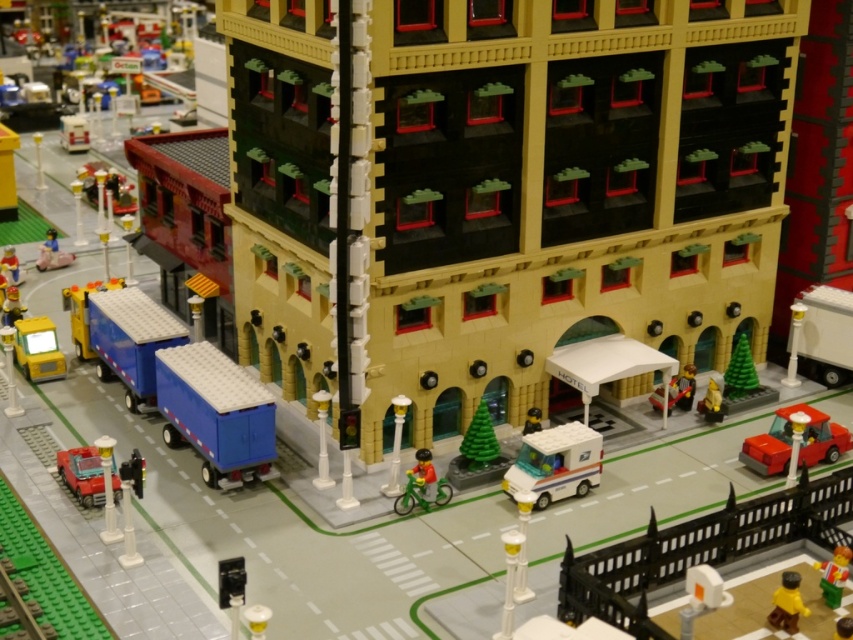
Is yellow matte figure at lower right taller than green plastic figure at lower right?

Yes, yellow matte figure at lower right is taller than green plastic figure at lower right.

Does yellow matte figure at lower right come behind green plastic figure at lower right?

No, it is in front of green plastic figure at lower right.

This screenshot has height=640, width=853. Describe the element at coordinates (787, 604) in the screenshot. I see `yellow matte figure at lower right` at that location.

Locate an element on the screen. This screenshot has width=853, height=640. yellow matte figure at lower right is located at coordinates pos(787,604).

In the scene shown: Is matte yellow truck at left taller than matte black mailbox at center?

Yes, matte yellow truck at left is taller than matte black mailbox at center.

Is matte yellow truck at left thinner than matte black mailbox at center?

No, matte yellow truck at left is not thinner than matte black mailbox at center.

Locate an element on the screen. matte yellow truck at left is located at coordinates (38, 348).

Identify the location of matte yellow truck at left. (38, 348).

Consider the image. Is matte yellow truck at left smaller than green matte christmas tree at center-right?

No.

Which is above, matte yellow truck at left or green matte christmas tree at center-right?

matte yellow truck at left

This screenshot has width=853, height=640. What do you see at coordinates (38, 348) in the screenshot? I see `matte yellow truck at left` at bounding box center [38, 348].

I want to click on matte yellow truck at left, so click(x=38, y=348).